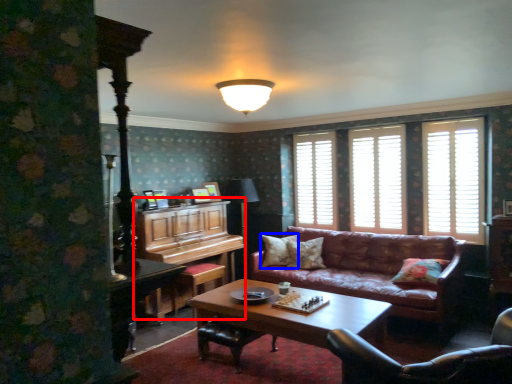
Question: Among these objects, which one is farthest to the camera, dresser (highlighted by a red box) or pillow (highlighted by a blue box)?

Choices:
 (A) dresser
 (B) pillow

Answer: (B)